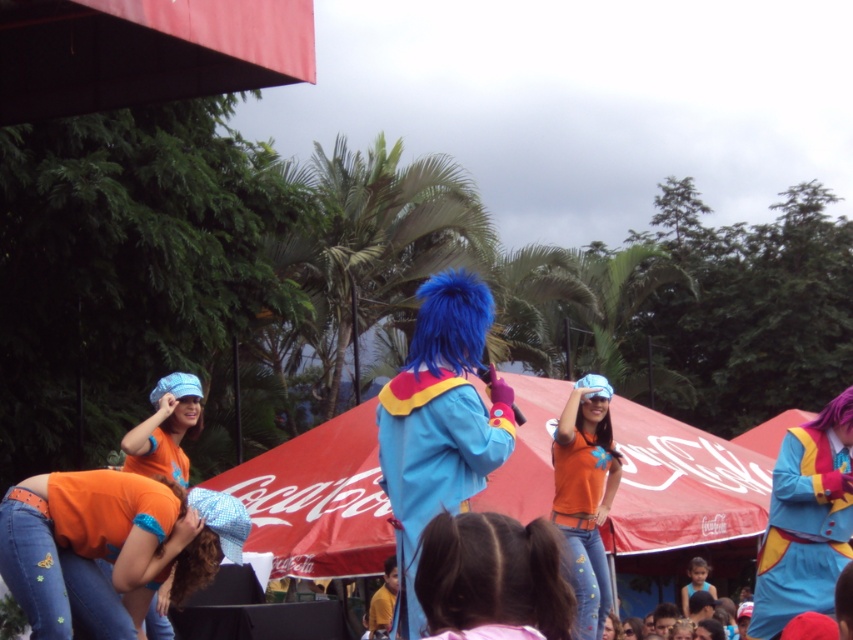
Question: Estimate the real-world distances between objects in this image. Which object is farther from the denim jeans at lower left?

Choices:
 (A) smooth brown hair at center
 (B) matte blue costume at center

Answer: (B)

Question: Which of these objects is positioned closest to the blue fabric costume at center?

Choices:
 (A) smooth brown hair at center
 (B) matte blue costume at center
 (C) denim jeans at lower left

Answer: (C)

Question: Is the position of matte blue costume at center more distant than that of matte orange shirt at center?

Choices:
 (A) no
 (B) yes

Answer: (A)

Question: Is blue fabric costume at center below matte blue costume at center?

Choices:
 (A) yes
 (B) no

Answer: (B)

Question: Among these objects, which one is farthest from the camera?

Choices:
 (A) denim jeans at lower left
 (B) blue fabric costume at center
 (C) matte blue costume at center
 (D) smooth brown hair at center

Answer: (C)

Question: Is blue fabric costume at center in front of matte blue fabric hat at lower left?

Choices:
 (A) yes
 (B) no

Answer: (A)